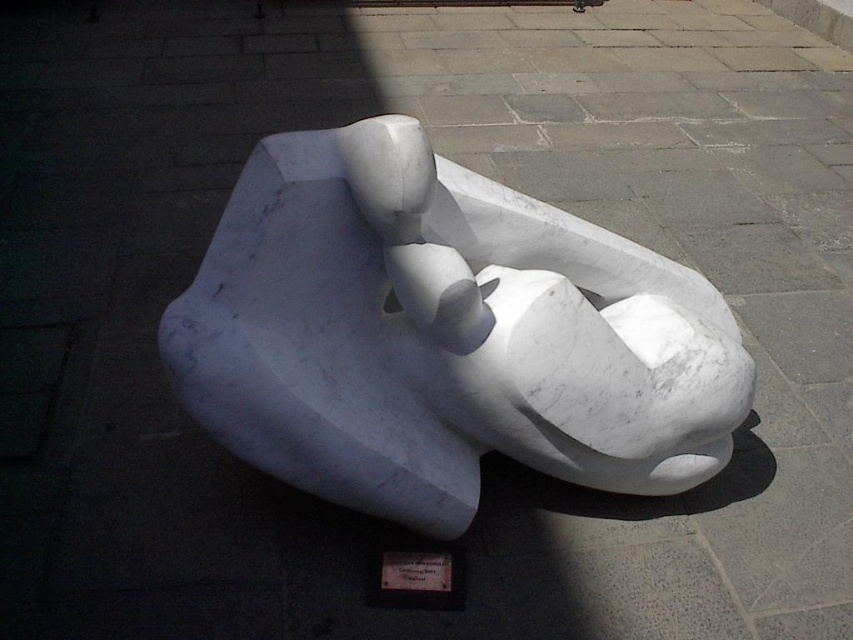
Can you confirm if white marble sculpture at center is shorter than wooden plaque at center?

In fact, white marble sculpture at center may be taller than wooden plaque at center.

You are a GUI agent. You are given a task and a screenshot of the screen. Output one action in this format:
    pyautogui.click(x=<x>, y=<y>)
    Task: Click on the white marble sculpture at center
    Image resolution: width=853 pixels, height=640 pixels.
    Given the screenshot: What is the action you would take?
    pyautogui.click(x=444, y=333)